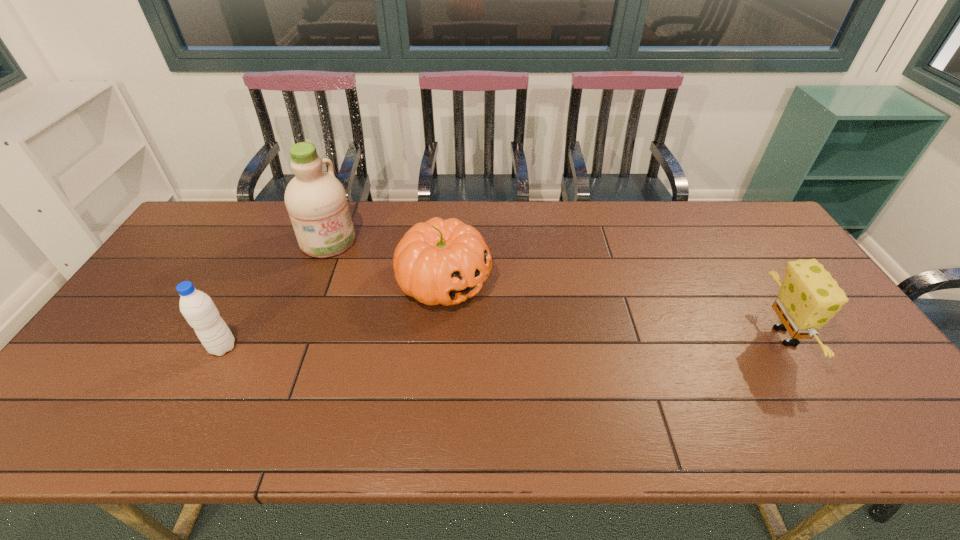
This screenshot has width=960, height=540. In the image, there is a desktop. What are the coordinates of `free space at the near right corner` in the screenshot? It's located at (850, 387).

You are a GUI agent. You are given a task and a screenshot of the screen. Output one action in this format:
    pyautogui.click(x=<x>, y=<y>)
    Task: Click on the free space between the pumpkin and the tallest object
    The width and height of the screenshot is (960, 540).
    Given the screenshot: What is the action you would take?
    pyautogui.click(x=386, y=261)

You are a GUI agent. You are given a task and a screenshot of the screen. Output one action in this format:
    pyautogui.click(x=<x>, y=<y>)
    Task: Click on the blank region between the second object from right to left and the leftmost object
    The image size is (960, 540).
    Given the screenshot: What is the action you would take?
    pyautogui.click(x=333, y=314)

The height and width of the screenshot is (540, 960). I want to click on vacant space in between the water bottle and the cleansing agent, so click(x=276, y=294).

Image resolution: width=960 pixels, height=540 pixels. I want to click on empty space between the rightmost object and the third object from left to right, so click(x=613, y=309).

This screenshot has width=960, height=540. I want to click on vacant space that's between the sponge and the third object from right to left, so click(556, 289).

This screenshot has width=960, height=540. Find the location of `unoccupied position between the second object from left to right and the third object from left to right`. unoccupied position between the second object from left to right and the third object from left to right is located at coordinates (386, 261).

What are the coordinates of `vacant space that's between the leftmost object and the rightmost object` in the screenshot? It's located at (503, 342).

You are a GUI agent. You are given a task and a screenshot of the screen. Output one action in this format:
    pyautogui.click(x=<x>, y=<y>)
    Task: Click on the vacant area between the leftmost object and the sponge
    The height and width of the screenshot is (540, 960).
    Given the screenshot: What is the action you would take?
    pyautogui.click(x=503, y=342)

The image size is (960, 540). Identify the location of unoccupied position between the pumpkin and the sponge. [x=613, y=309].